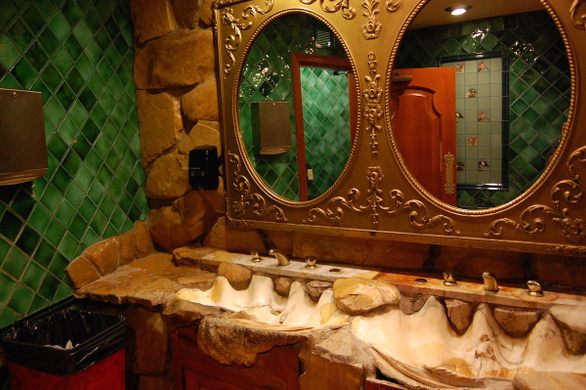
Where is `left mirror`? This screenshot has width=586, height=390. left mirror is located at coordinates (284, 11), (237, 79), (245, 155), (281, 198), (350, 156), (353, 64).